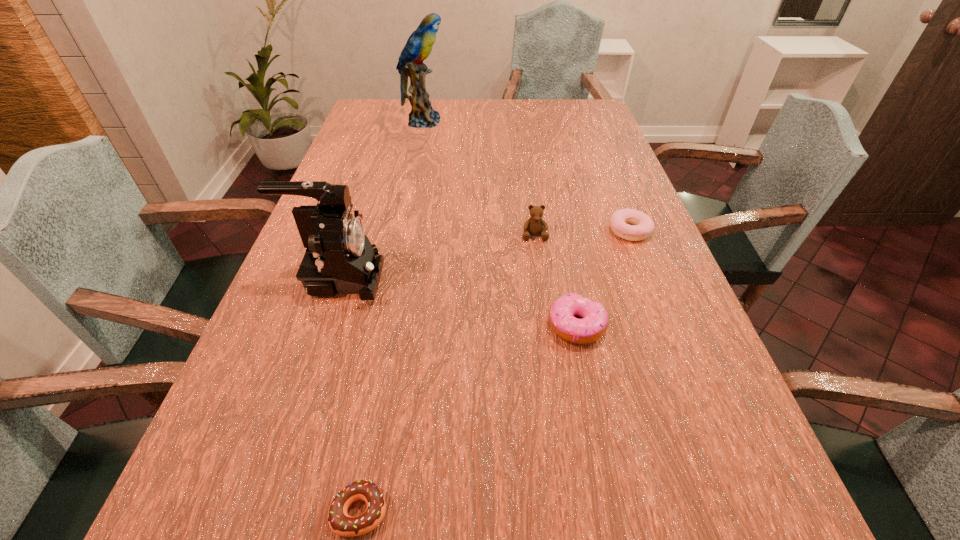
Find the location of `unoccupied position between the teddy bear and the parrot`. unoccupied position between the teddy bear and the parrot is located at coordinates (479, 178).

Locate an element on the screen. empty space that is in between the fifth shortest object and the second farthest doughnut is located at coordinates [x=458, y=302].

Where is `vacant space in between the leftmost doughnut and the farthest doughnut`? The height and width of the screenshot is (540, 960). vacant space in between the leftmost doughnut and the farthest doughnut is located at coordinates (494, 370).

Where is `free space between the teddy bear and the nearest doughnut`? This screenshot has height=540, width=960. free space between the teddy bear and the nearest doughnut is located at coordinates coord(447,373).

Image resolution: width=960 pixels, height=540 pixels. I want to click on the second closest object relative to the fourth shortest object, so click(594, 323).

Select which object appears as the third closest to the second tallest doughnut. Please provide its 2D coordinates. Your answer should be formatted as a tuple, i.e. [(x, y)], where the tuple contains the x and y coordinates of a point satisfying the conditions above.

[(339, 258)]

Select which doughnut appears as the closest to the teddy bear. Please provide its 2D coordinates. Your answer should be formatted as a tuple, i.e. [(x, y)], where the tuple contains the x and y coordinates of a point satisfying the conditions above.

[(642, 225)]

Locate which doughnut ranks second in proximity to the second doughnut from left to right. Please provide its 2D coordinates. Your answer should be formatted as a tuple, i.e. [(x, y)], where the tuple contains the x and y coordinates of a point satisfying the conditions above.

[(340, 523)]

I want to click on free space in the image that satisfies the following two spatial constraints: 1. on the lens mount of the second farthest doughnut; 2. on the left side of the second tallest object, so click(x=324, y=326).

This screenshot has height=540, width=960. What are the coordinates of `vacant region that satisfies the following two spatial constraints: 1. on the front-facing side of the teddy bear; 2. on the left side of the second doughnut from left to right` in the screenshot? It's located at (547, 326).